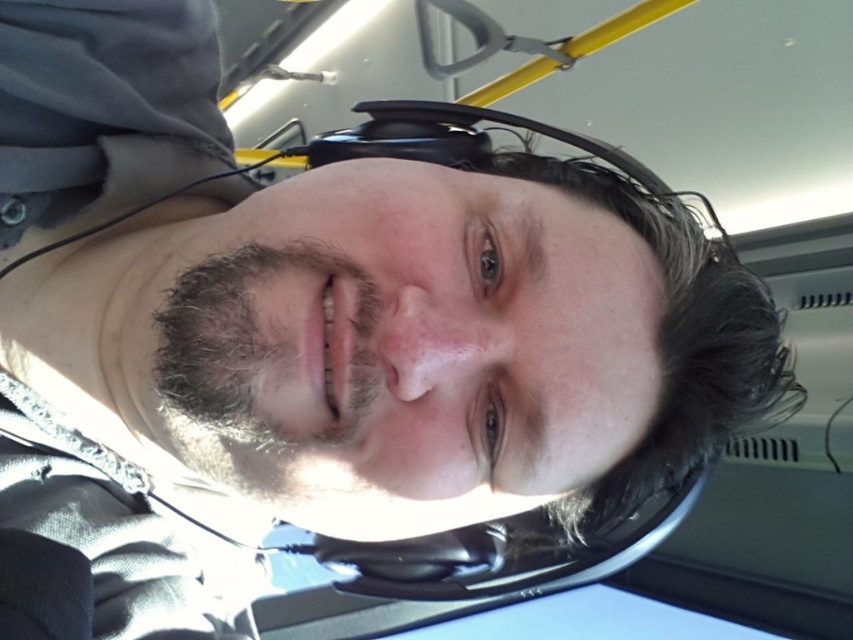
You are a passenger on a bus and want to check your reflection in the black matte view mirror at center. However, you notice dark brown curly hair at lower left blocking your view. Can you determine which object is taller to figure out if the hair is covering the mirror?

The black matte view mirror at center is taller than dark brown curly hair at lower left, so the mirror is taller and the hair might not fully cover it.